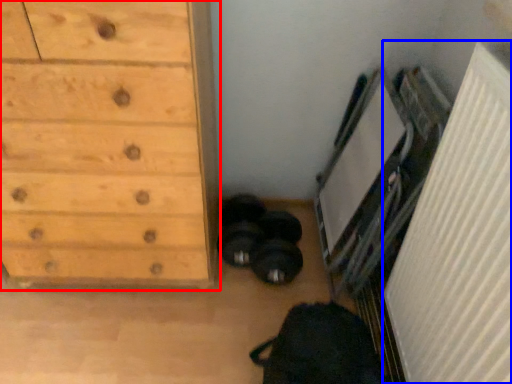
Question: Which of the following is the closest to the observer, chest of drawers (highlighted by a red box) or radiator (highlighted by a blue box)?

Choices:
 (A) chest of drawers
 (B) radiator

Answer: (B)